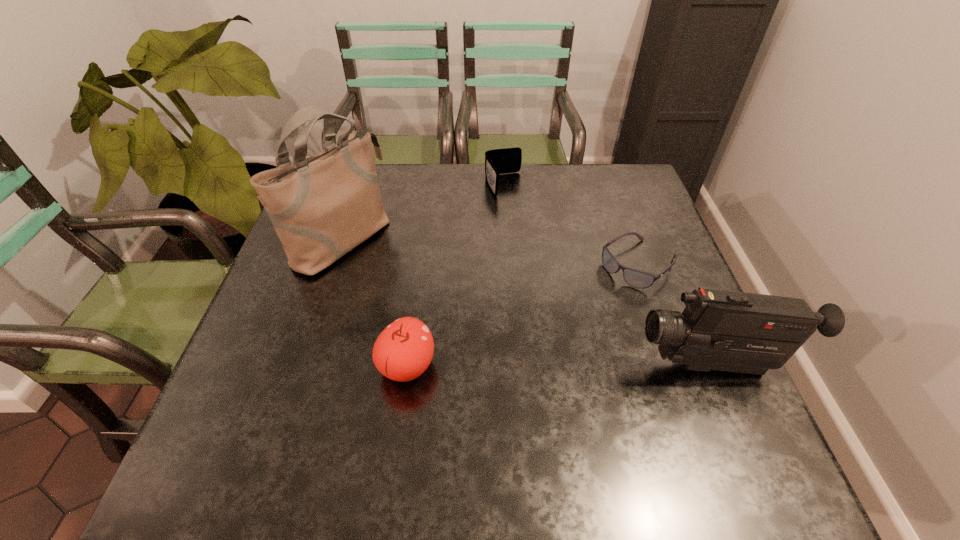
Image resolution: width=960 pixels, height=540 pixels. I want to click on vacant space located on the front-facing side of the camcorder, so click(523, 366).

The height and width of the screenshot is (540, 960). Find the location of `vacant space situated 0.200m on the front-facing side of the camcorder`. vacant space situated 0.200m on the front-facing side of the camcorder is located at coordinates (538, 366).

Where is `vacant space located 0.110m on the front-facing side of the leftmost object`? This screenshot has height=540, width=960. vacant space located 0.110m on the front-facing side of the leftmost object is located at coordinates (404, 279).

Locate an element on the screen. This screenshot has width=960, height=540. vacant space situated 0.390m on the front-facing side of the leftmost object is located at coordinates (500, 333).

I want to click on vacant space located on the front-facing side of the leftmost object, so click(x=430, y=293).

The image size is (960, 540). I want to click on free region located 0.380m on the outer surface of the farthest object, so click(x=559, y=288).

This screenshot has height=540, width=960. In order to click on vacant region located 0.350m on the outer surface of the farthest object in this screenshot , I will do `click(554, 280)`.

Identify the location of vacant space situated 0.180m on the outer surface of the farthest object. Image resolution: width=960 pixels, height=540 pixels. (530, 236).

At what (x,y) coordinates should I click in order to perform the action: click on free location located 0.220m on the lenses of the sunglasses. Please return your answer as a coordinate pair (x, y). Looking at the image, I should click on (558, 332).

The image size is (960, 540). I want to click on vacant point located on the lenses of the sunglasses, so pos(545,342).